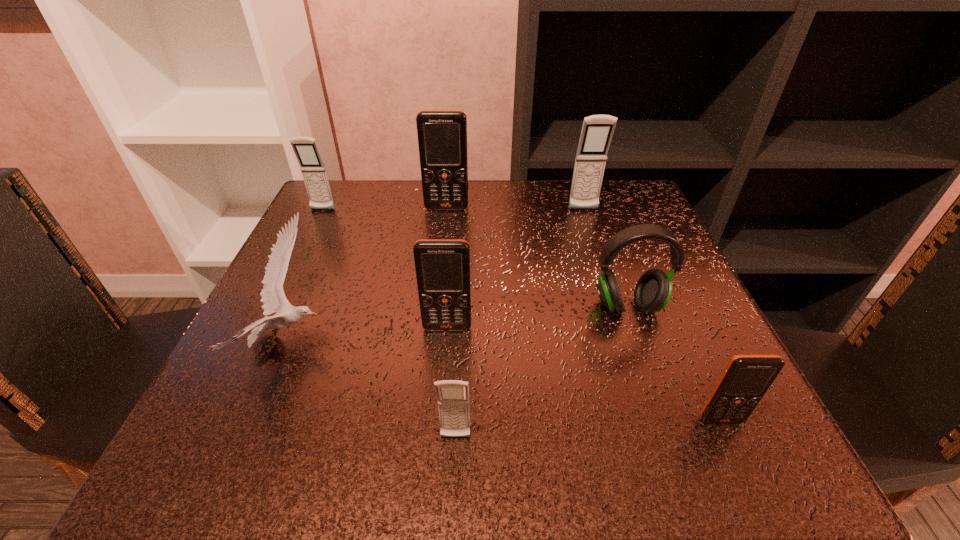
Locate an element on the screen. vacant area between the second gray cellular telephone from left to right and the leftmost cellular telephone is located at coordinates (389, 324).

Image resolution: width=960 pixels, height=540 pixels. In order to click on free space between the second farthest orange cellular telephone and the fifth farthest cellular telephone in this screenshot , I will do `click(585, 374)`.

Select which object is the second closest to the second cellular telephone from right to left. Please provide its 2D coordinates. Your answer should be formatted as a tuple, i.e. [(x, y)], where the tuple contains the x and y coordinates of a point satisfying the conditions above.

[(653, 290)]

Find the location of `object that is the fourth closest to the second smallest gray cellular telephone`. object that is the fourth closest to the second smallest gray cellular telephone is located at coordinates (597, 130).

Point out which cellular telephone is positioned as the sixth nearest to the gull. Please provide its 2D coordinates. Your answer should be formatted as a tuple, i.e. [(x, y)], where the tuple contains the x and y coordinates of a point satisfying the conditions above.

[(746, 378)]

Select which cellular telephone appears as the third closest to the white gull. Please provide its 2D coordinates. Your answer should be formatted as a tuple, i.e. [(x, y)], where the tuple contains the x and y coordinates of a point satisfying the conditions above.

[(306, 150)]

Choose which gray cellular telephone is the second nearest neighbor to the leftmost cellular telephone. Please provide its 2D coordinates. Your answer should be formatted as a tuple, i.e. [(x, y)], where the tuple contains the x and y coordinates of a point satisfying the conditions above.

[(453, 395)]

Locate an element on the screen. the second closest gray cellular telephone relative to the leftmost cellular telephone is located at coordinates (453, 395).

Locate which orange cellular telephone is the second closest to the leftmost gray cellular telephone. Please provide its 2D coordinates. Your answer should be formatted as a tuple, i.e. [(x, y)], where the tuple contains the x and y coordinates of a point satisfying the conditions above.

[(442, 266)]

What are the coordinates of `orange cellular telephone object that ranks as the closest to the leftmost gray cellular telephone` in the screenshot? It's located at (442, 135).